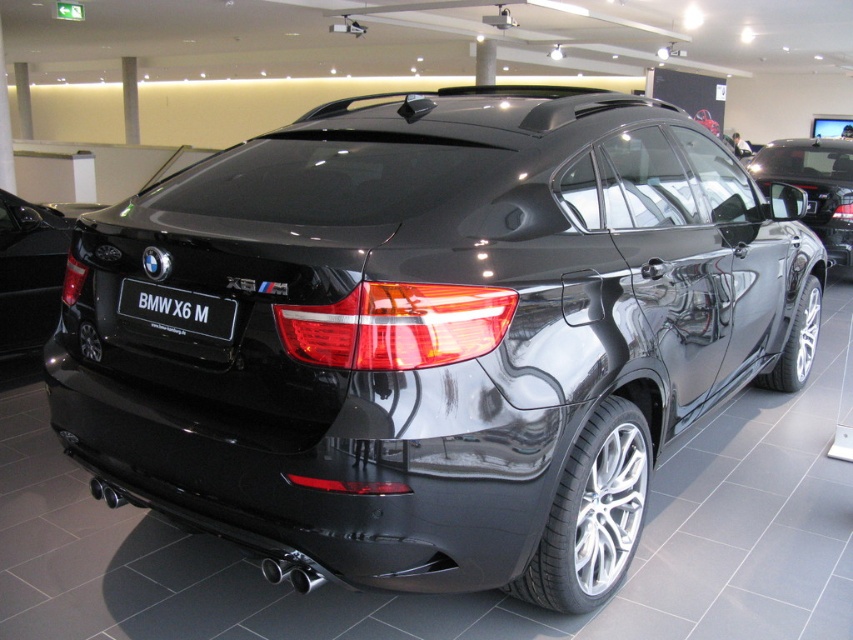
In the scene shown: Between glossy black car at center and glossy black car at right, which one has more height?

glossy black car at right is taller.

Can you confirm if glossy black car at center is positioned to the left of glossy black car at right?

Indeed, glossy black car at center is positioned on the left side of glossy black car at right.

Which is behind, point (32, 205) or point (831, 246)?

The point (831, 246) is behind.

Identify the location of glossy black car at center. pos(28,272).

Describe the element at coordinates (28, 272) in the screenshot. The height and width of the screenshot is (640, 853). I see `glossy black car at center` at that location.

Which is behind, point (10, 250) or point (202, 324)?

Point (10, 250)

You are a GUI agent. You are given a task and a screenshot of the screen. Output one action in this format:
    pyautogui.click(x=<x>, y=<y>)
    Task: Click on the glossy black car at center
    
    Given the screenshot: What is the action you would take?
    pyautogui.click(x=28, y=272)

Is point (813, 209) less distant than point (120, 289)?

No.

Who is lower down, glossy black car at right or black glossy license plate at center?

Positioned lower is black glossy license plate at center.

Image resolution: width=853 pixels, height=640 pixels. I want to click on glossy black car at right, so click(814, 186).

Find the location of a particular element. This screenshot has height=640, width=853. glossy black car at right is located at coordinates (814, 186).